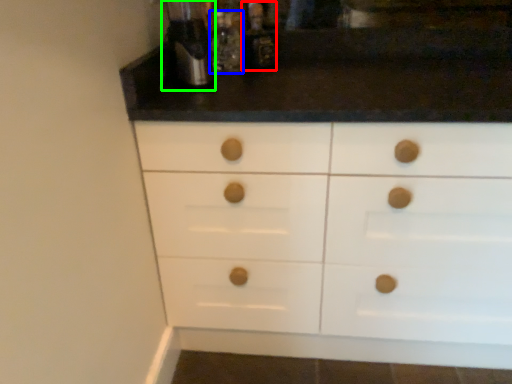
Question: Which object is positioned farthest from bottle (highlighted by a red box)? Select from bottle (highlighted by a blue box) and coffee machine (highlighted by a green box).

Choices:
 (A) bottle
 (B) coffee machine

Answer: (B)